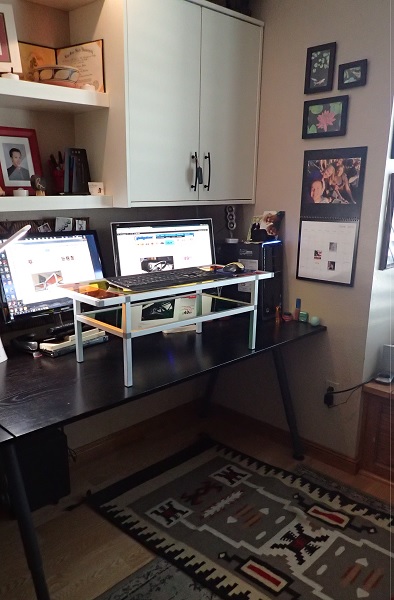
Locate an element on the screen. This screenshot has height=600, width=394. rug is located at coordinates (203, 549).